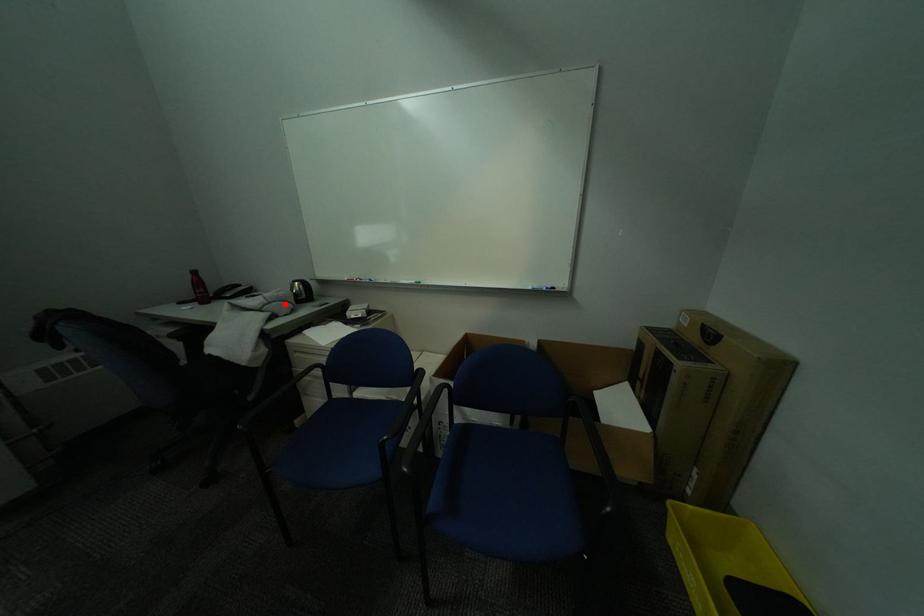
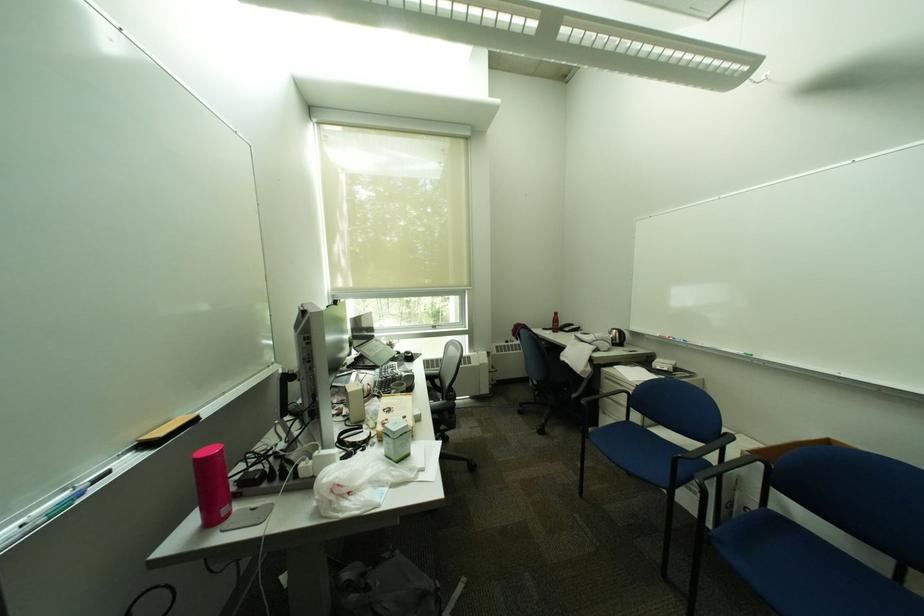
In the second image, find the point that corresponds to the highlighted location in the first image.

(611, 342)